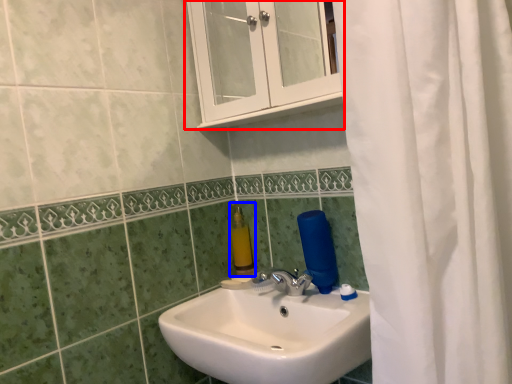
Question: Among these objects, which one is farthest to the camera, medicine cabinet (highlighted by a red box) or soap dispenser (highlighted by a blue box)?

Choices:
 (A) medicine cabinet
 (B) soap dispenser

Answer: (B)